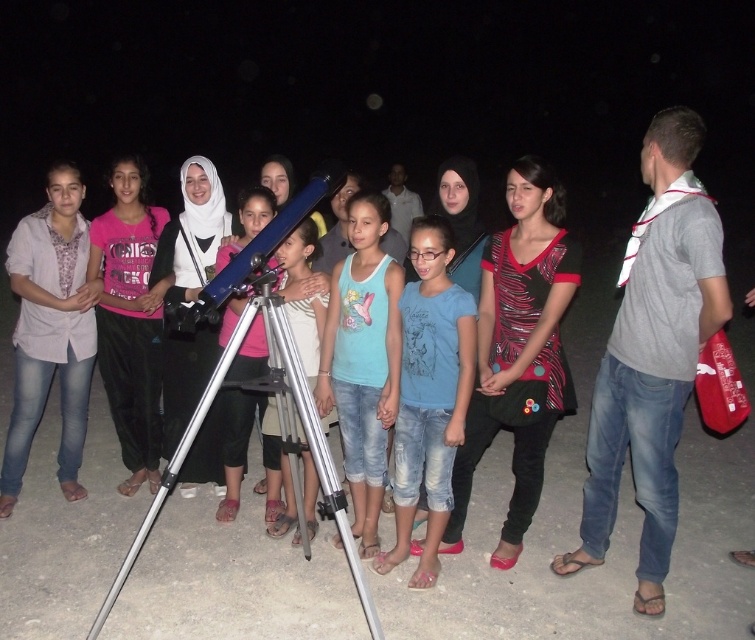
Who is more forward, [51,196] or [378,305]?

Point [378,305] is more forward.

Is matte gray shirt at left thinner than light blue denim shorts at center?

In fact, matte gray shirt at left might be wider than light blue denim shorts at center.

Find the location of a particular element. This screenshot has width=755, height=640. matte gray shirt at left is located at coordinates (51, 330).

Based on the photo, which is below, light blue denim shorts at center or pink fabric shirt at center?

light blue denim shorts at center is lower down.

Does point (387, 262) lie behind point (91, 269)?

No, it is not.

Image resolution: width=755 pixels, height=640 pixels. What are the coordinates of `light blue denim shorts at center` in the screenshot? It's located at point(362,358).

This screenshot has height=640, width=755. I want to click on light blue denim shorts at center, so pos(362,358).

Does blue denim jeans at center come in front of pink fabric shirt at center?

That is True.

Can you confirm if blue denim jeans at center is positioned below pink fabric shirt at center?

Yes, blue denim jeans at center is below pink fabric shirt at center.

Does point (458, 401) come farther from viewer compared to point (113, 320)?

No, it is not.

Where is `blue denim jeans at center`? Image resolution: width=755 pixels, height=640 pixels. blue denim jeans at center is located at coordinates click(x=430, y=394).